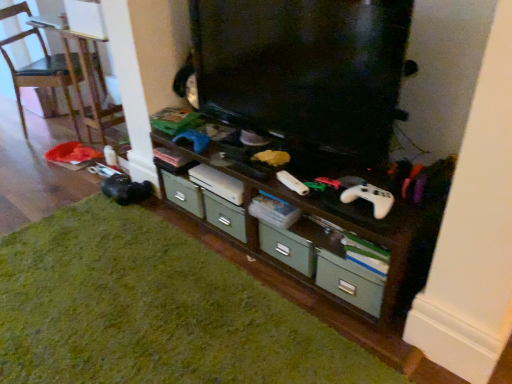
Locate an element on the screen. vacant space situated above wooden shelf at center (from a real-world perspective) is located at coordinates (258, 160).